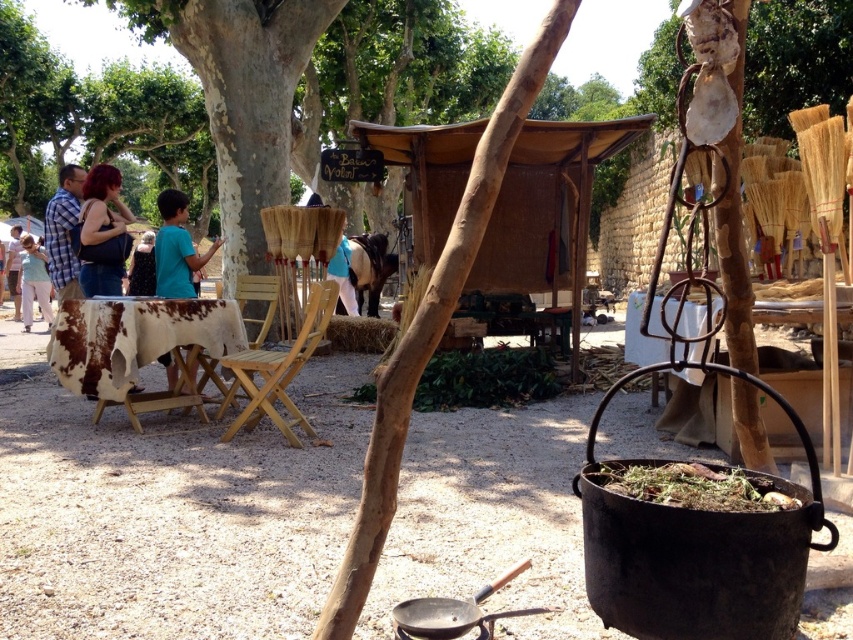
Does plaid shirt at left have a greater height compared to light blue shirt at center?

No, plaid shirt at left is not taller than light blue shirt at center.

Describe the element at coordinates (62, 230) in the screenshot. I see `plaid shirt at left` at that location.

This screenshot has height=640, width=853. I want to click on plaid shirt at left, so click(x=62, y=230).

Is matte black tank top at center positioned at the back of light blue shirt at left?

No, it is in front of light blue shirt at left.

Can you confirm if matte black tank top at center is taller than light blue shirt at left?

Incorrect, matte black tank top at center's height is not larger of light blue shirt at left's.

Who is more distant from viewer, (91, 237) or (36, 300)?

Point (36, 300)

Locate an element on the screen. The image size is (853, 640). matte black tank top at center is located at coordinates (102, 209).

Is matte black tank top at center positioned before teal shirt at center?

That is False.

Is matte black tank top at center positioned behind teal shirt at center?

Yes, matte black tank top at center is behind teal shirt at center.

Between point (120, 212) and point (192, 244), which one is positioned in front?

Positioned in front is point (120, 212).

Identify the location of matte black tank top at center. The width and height of the screenshot is (853, 640). (102, 209).